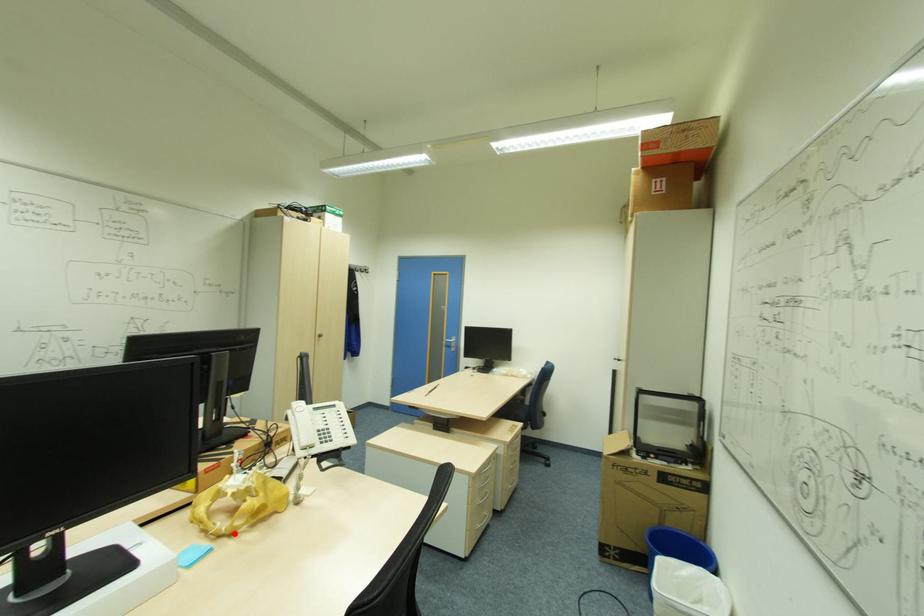
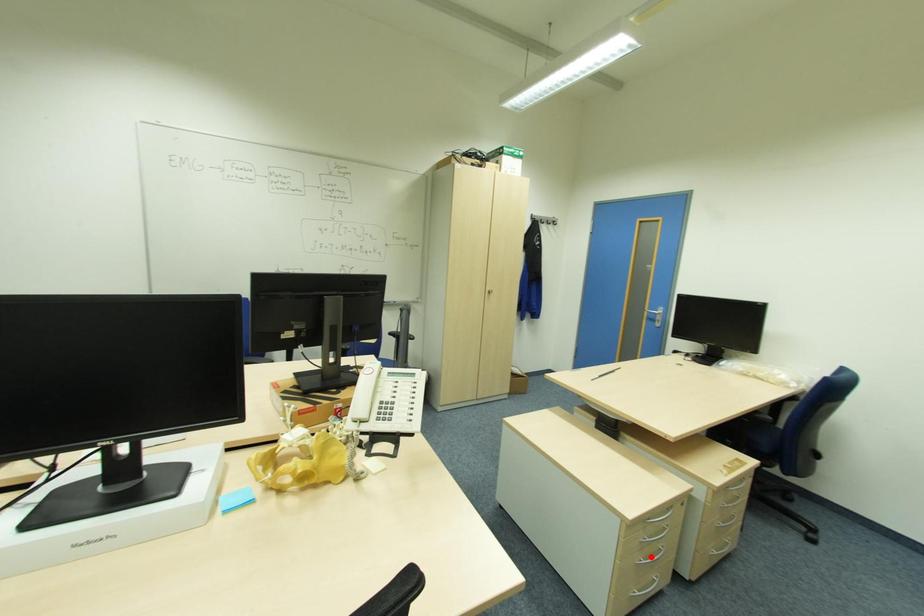
I am providing you with two images of the same scene from different viewpoints. A red point is marked on the first image and another point is marked on the second image. Is the red point in image1 aligned with the point shown in image2?

No